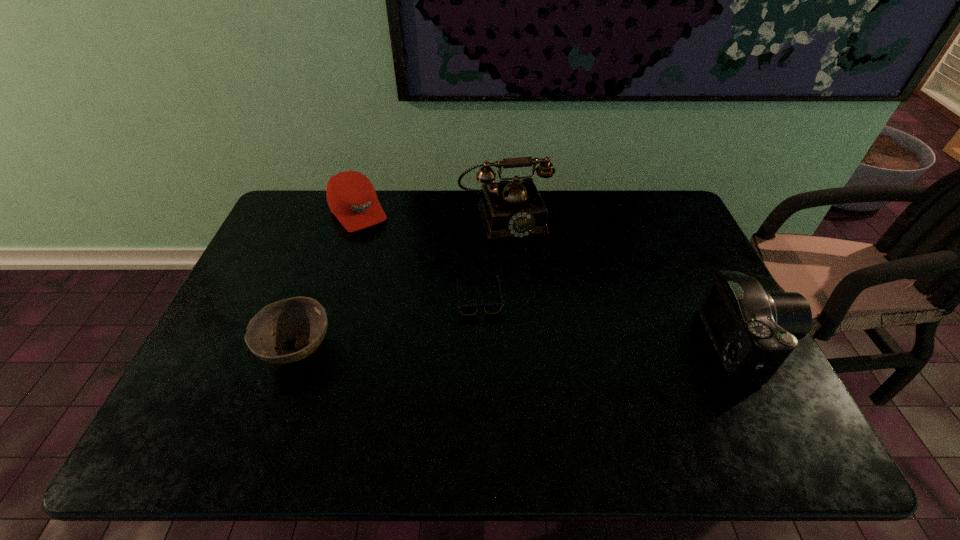
Identify the location of free spot on the desktop that is between the second shortest object and the camera and is positioned on the dial of the telephone. (548, 347).

This screenshot has width=960, height=540. In order to click on free space on the desktop that is between the fourth tallest object and the rightmost object and is positioned on the front-facing side of the cap in this screenshot , I will do `click(463, 347)`.

Identify the location of vacant space on the desktop that is between the second shortest object and the camera and is positioned on the lenses of the sunglasses. (523, 347).